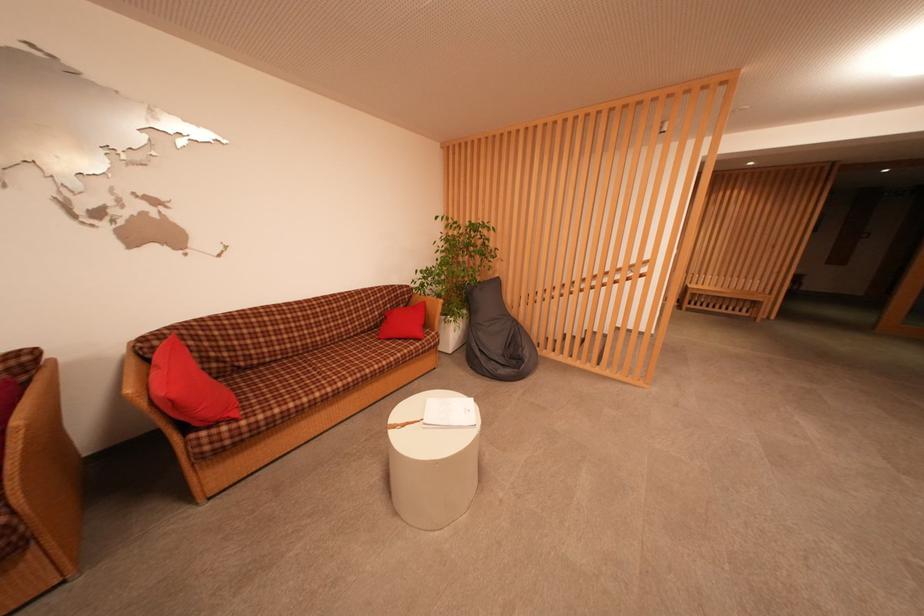
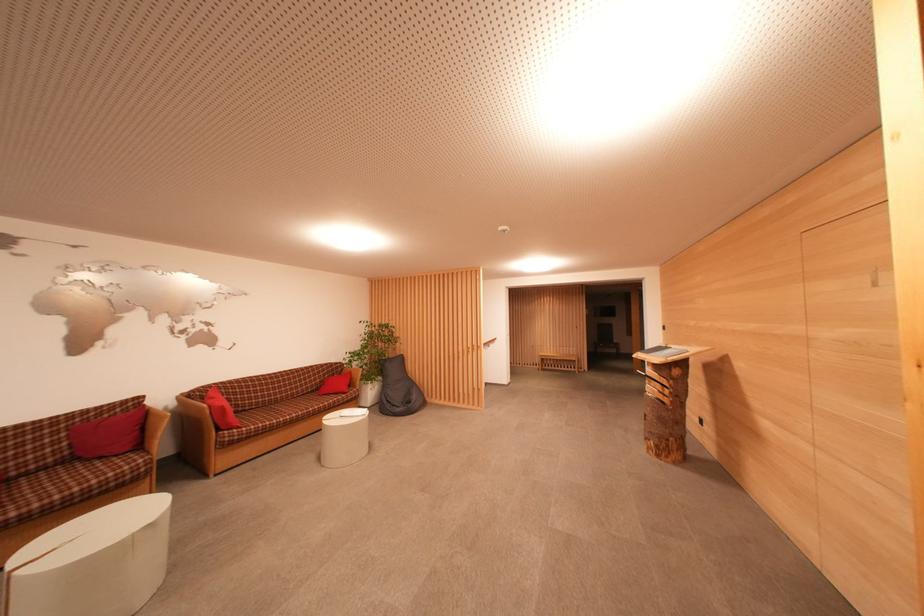
Locate, in the second image, the point that corresponds to [402,307] in the first image.

(337, 378)